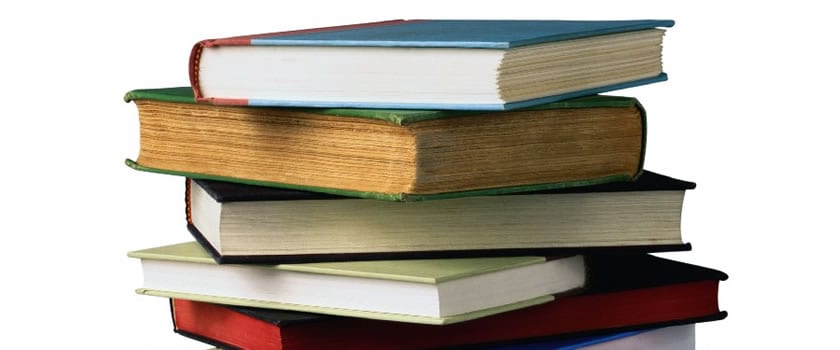
Locate an element on the screen. This screenshot has height=350, width=840. books is located at coordinates [x=641, y=339], [x=628, y=306], [x=452, y=280], [x=476, y=221], [x=463, y=150], [x=465, y=67].